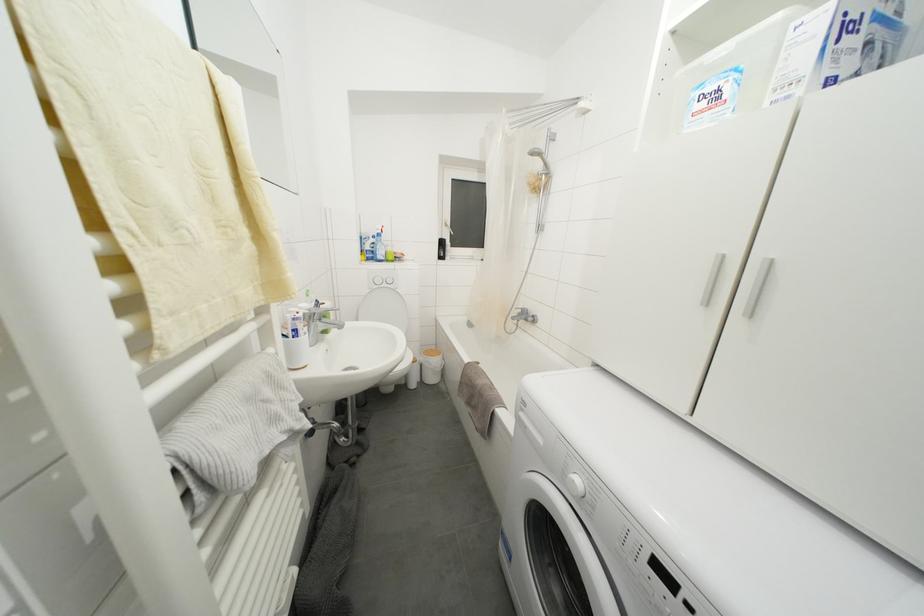
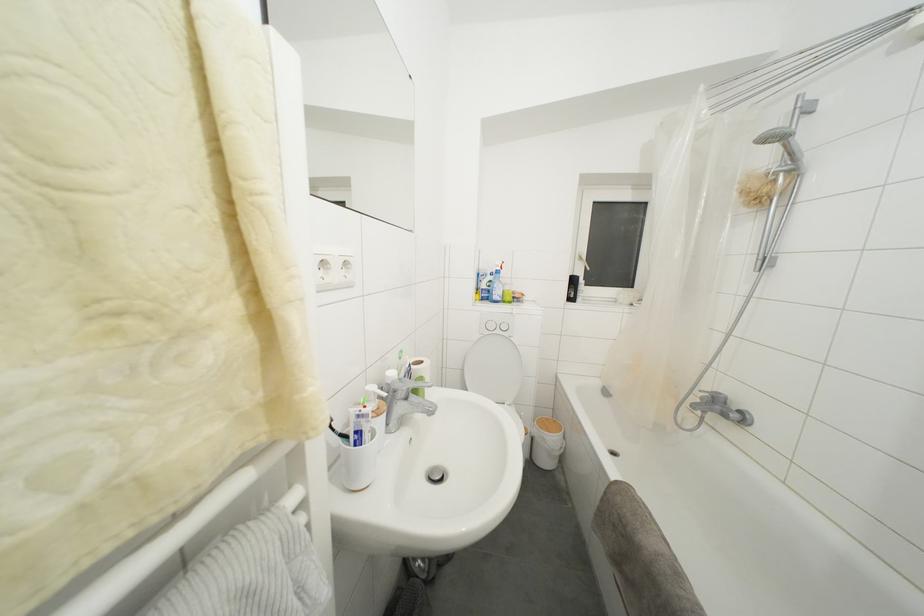
In the second image, find the point that corresponds to the point at 402,262 in the first image.

(520, 304)